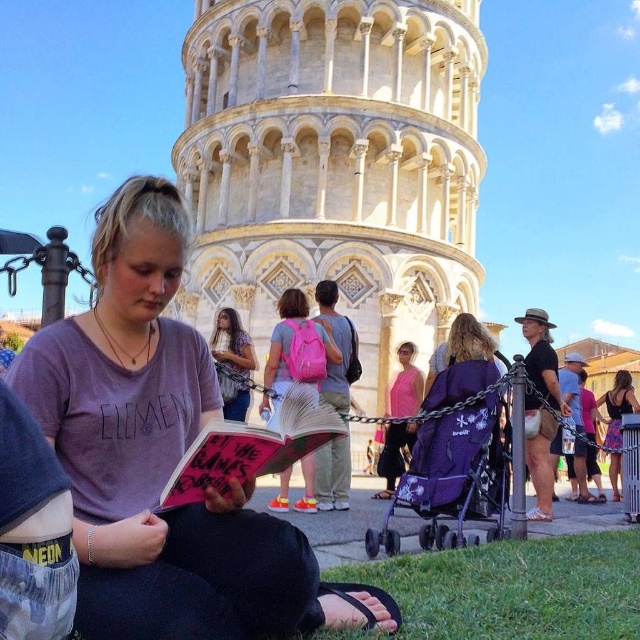
Does white stone tower at center have a greater height compared to purple fabric stroller at center?

Yes.

In the scene shown: Which is above, white stone tower at center or purple fabric stroller at center?

white stone tower at center is higher up.

Which is in front, point (460, 188) or point (490, 348)?

Positioned in front is point (490, 348).

This screenshot has height=640, width=640. Find the location of `white stone tower at center`. white stone tower at center is located at coordinates (333, 164).

Does green grass at lower center lie in front of floral dress at center?

Yes.

Is point (596, 573) closer to viewer compared to point (628, 394)?

Yes.

I want to click on green grass at lower center, so click(x=515, y=588).

Is pink fabric dress at center wider than denim jacket at center?

Yes, pink fabric dress at center is wider than denim jacket at center.

Is point (403, 353) farther from viewer compared to point (241, 392)?

Yes, it is.

What are the coordinates of `pink fabric dress at center` in the screenshot? It's located at (404, 385).